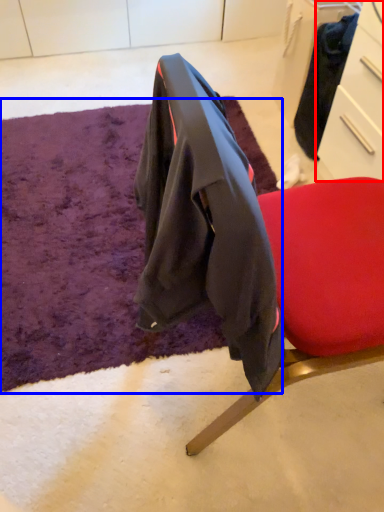
Question: Which object is further to the camera taking this photo, drawer (highlighted by a red box) or mat (highlighted by a blue box)?

Choices:
 (A) drawer
 (B) mat

Answer: (A)